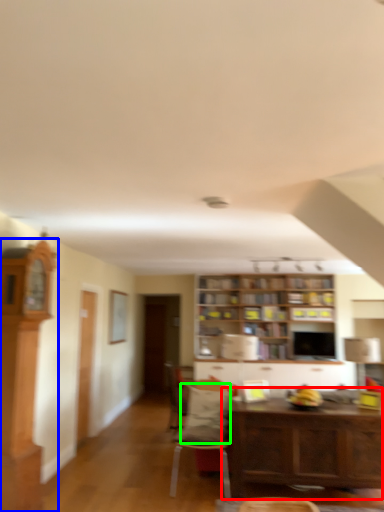
Question: Based on their relative distances, which object is farther from table (highlighted by a red box)? Choose from cabinetry (highlighted by a blue box) and pillow (highlighted by a green box).

Choices:
 (A) cabinetry
 (B) pillow

Answer: (A)